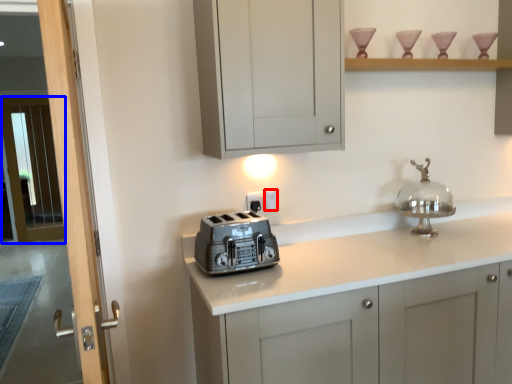
Question: Which object appears farthest to the camera in this image, electric outlet (highlighted by a red box) or screen door (highlighted by a blue box)?

Choices:
 (A) electric outlet
 (B) screen door

Answer: (B)